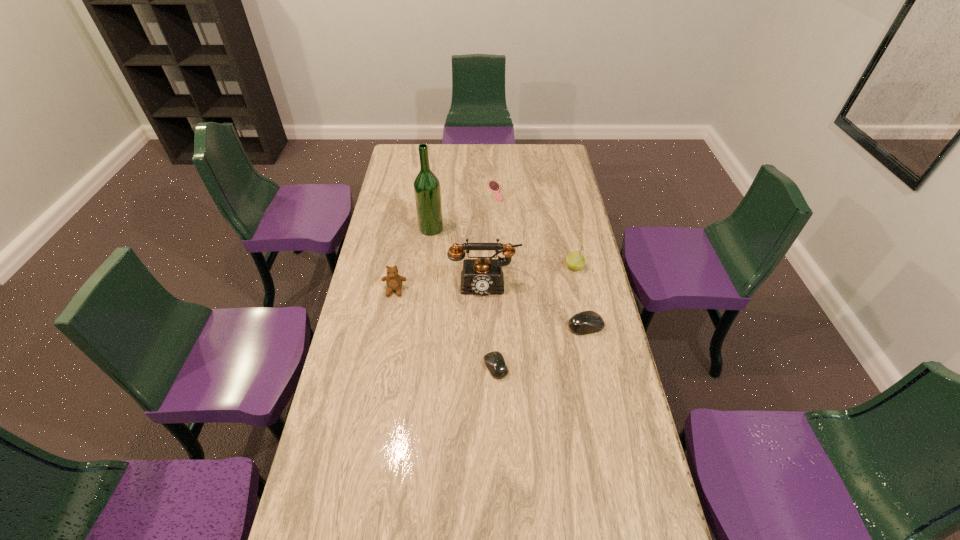
This screenshot has height=540, width=960. Identify the location of the left mouse. (494, 361).

Locate an element on the screen. The height and width of the screenshot is (540, 960). the sixth tallest object is located at coordinates (494, 361).

Locate an element on the screen. the second nearest object is located at coordinates (586, 322).

The width and height of the screenshot is (960, 540). Find the location of `the fifth tallest object`. the fifth tallest object is located at coordinates (586, 322).

This screenshot has height=540, width=960. I want to click on the farthest object, so click(494, 186).

Identify the location of the shortest object. Image resolution: width=960 pixels, height=540 pixels. (494, 186).

The image size is (960, 540). Find the location of `the tallest object`. the tallest object is located at coordinates (427, 191).

Locate an element on the screen. the sixth nearest object is located at coordinates (427, 191).

At what (x,y) coordinates should I click in order to perform the action: click on teddy bear. Please return your answer as a coordinate pair (x, y). Image resolution: width=960 pixels, height=540 pixels. Looking at the image, I should click on (393, 280).

At what (x,y) coordinates should I click in order to perform the action: click on the second tallest object. Please return your answer as a coordinate pair (x, y). Looking at the image, I should click on (481, 276).